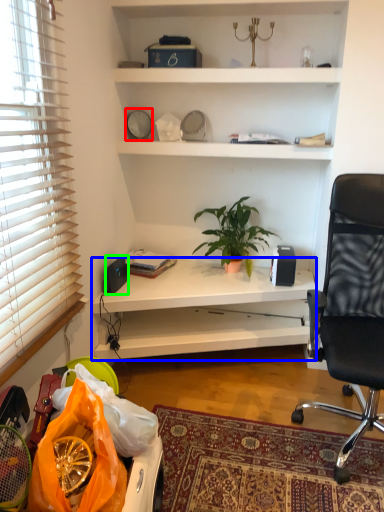
Question: Considering the real-world distances, which object is farthest from clock (highlighted by a red box)? desk (highlighted by a blue box) or loudspeaker (highlighted by a green box)?

Choices:
 (A) desk
 (B) loudspeaker

Answer: (A)